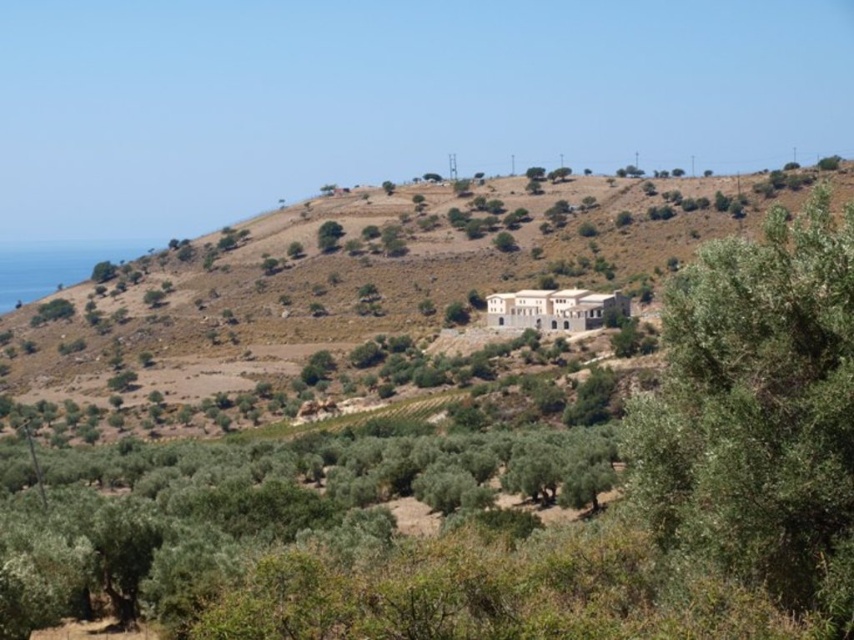
You are a landscape architect planning to install a new water feature that requires a stable base. Considering the beige stone building at center and the green leafy tree at upper center, which structure would provide a more stable foundation for the water feature?

The beige stone building at center has a greater height compared to the green leafy tree at upper center, so the beige stone building at center would provide a more stable foundation for the water feature since it is taller and likely more structurally robust.

You are standing at the point marked by the coordinates (757, 412) in the image. Looking around, you see a green leafy tree at center right. Which direction should you face to see the large modern building on the hillside crest?

The large modern building is located on the hillside crest, which is the highest point. Since you are at point (757, 412) facing the green leafy tree at center right, you should turn to face the direction opposite the tree to look towards the hilltop where the building stands.

Based on the photo, you are a hiker standing at the bottom of the hill looking up. You see the beige stone building at center and the green leafy tree at upper center. Which object is closer to you?

The beige stone building at center is closer to you because it is in front of the green leafy tree at upper center.